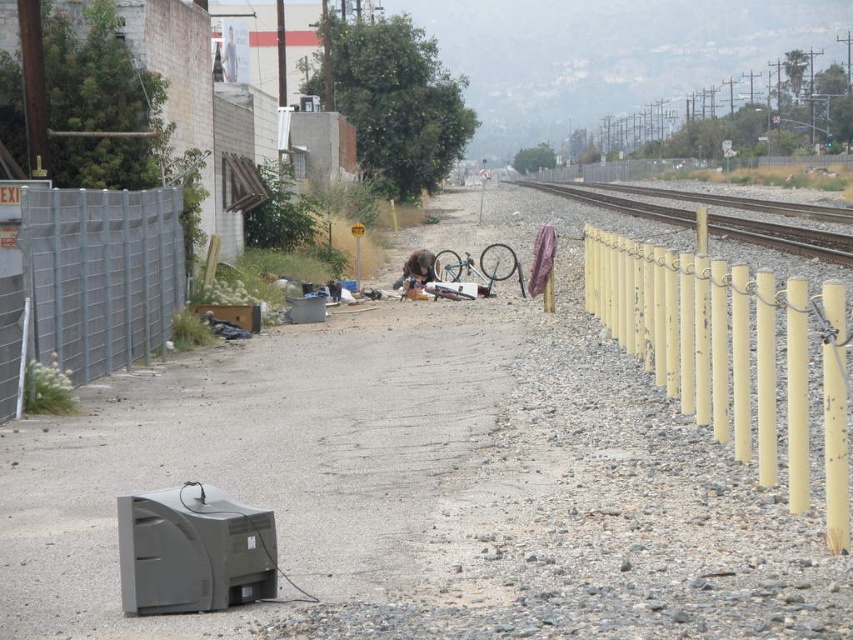
Question: Which object appears closest to the camera in this image?

Choices:
 (A) yellow painted metal poles at right
 (B) metallic gray fence at left
 (C) metallic train track at right

Answer: (A)

Question: Is yellow painted metal poles at right wider than metallic gray fence at left?

Choices:
 (A) yes
 (B) no

Answer: (A)

Question: Can you confirm if yellow painted metal poles at right is smaller than metallic gray fence at left?

Choices:
 (A) yes
 (B) no

Answer: (B)

Question: Which point is closer to the camera?

Choices:
 (A) metallic train track at right
 (B) metallic gray fence at left

Answer: (B)

Question: Which object is the farthest from the metallic gray fence at left?

Choices:
 (A) yellow painted metal poles at right
 (B) metallic train track at right

Answer: (B)

Question: Does yellow painted metal poles at right have a smaller size compared to metallic gray fence at left?

Choices:
 (A) yes
 (B) no

Answer: (B)